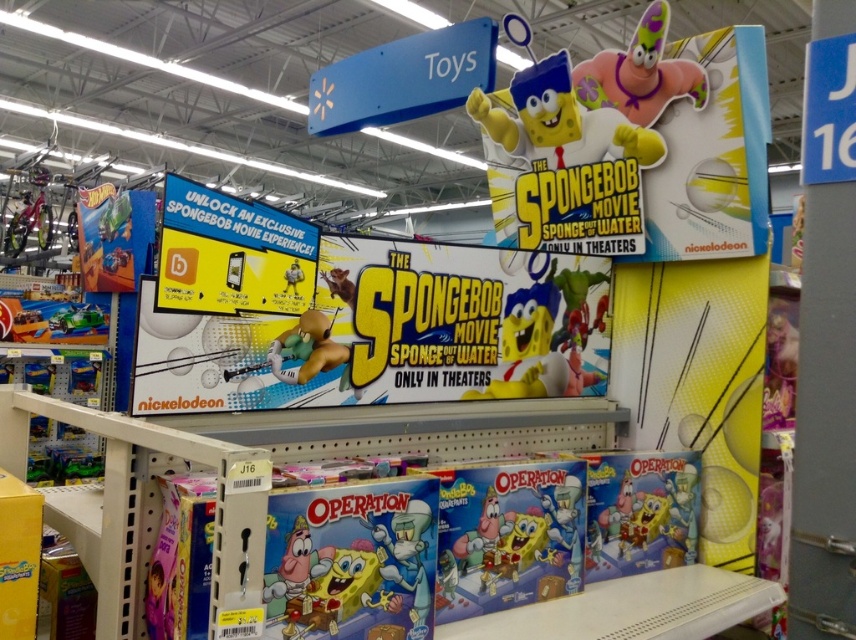
Is matte plastic toy at lower left bigger than matte green toy at lower left?

Incorrect, matte plastic toy at lower left is not larger than matte green toy at lower left.

Is point (90, 378) positioned after point (51, 376)?

Yes, it is behind point (51, 376).

Find the location of a particular element. This screenshot has height=640, width=856. matte plastic toy at lower left is located at coordinates (82, 376).

Is metallic silver bicycle at left further to camera compared to matte yellow sponge at center?

Yes.

Which of these two, metallic silver bicycle at left or matte yellow sponge at center, stands shorter?

matte yellow sponge at center

Where is `metallic silver bicycle at left`? This screenshot has width=856, height=640. metallic silver bicycle at left is located at coordinates (30, 216).

This screenshot has width=856, height=640. What are the coordinates of `metallic silver bicycle at left` in the screenshot? It's located at [30, 216].

Does yellow matte sponge at center have a greater height compared to matte green toy at lower left?

No.

Does point (513, 392) lie in front of point (27, 364)?

Yes.

Image resolution: width=856 pixels, height=640 pixels. What are the coordinates of `yellow matte sponge at center` in the screenshot? It's located at (513, 387).